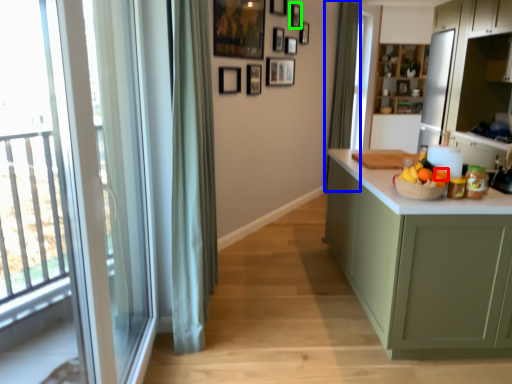
Question: Which is nearer to the orange (highlighted by a red box)? curtain (highlighted by a blue box) or picture frame (highlighted by a green box).

Choices:
 (A) curtain
 (B) picture frame

Answer: (B)